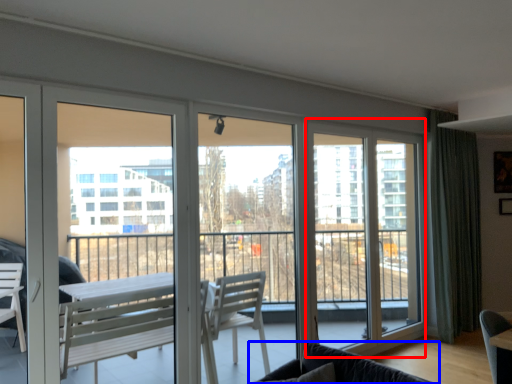
Question: Which of the following is the closest to the observer, screen door (highlighted by a red box) or studio couch (highlighted by a blue box)?

Choices:
 (A) screen door
 (B) studio couch

Answer: (B)